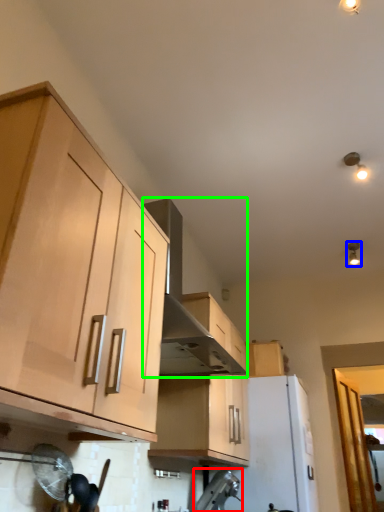
Question: Considering the real-world distances, which object is closest to appliance (highlighted by a red box)? light fixture (highlighted by a blue box) or vent (highlighted by a green box).

Choices:
 (A) light fixture
 (B) vent

Answer: (B)